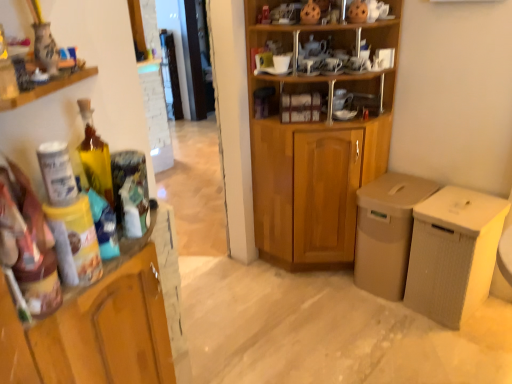
This screenshot has height=384, width=512. Identify the location of wooden cabinet at center. (298, 107).

This screenshot has width=512, height=384. Describe the element at coordinates (95, 155) in the screenshot. I see `translucent glass bottle at left` at that location.

Identify the location of wooden cabinet at center. (298, 107).

From the image's perspective, is matte ceramic vase at upper left located above translucent glass bottle at left?

Yes, from the image's perspective, matte ceramic vase at upper left is over translucent glass bottle at left.

Which of these two, matte ceramic vase at upper left or translucent glass bottle at left, is wider?

Wider between the two is matte ceramic vase at upper left.

Is matte ceramic vase at upper left beside translucent glass bottle at left?

No, matte ceramic vase at upper left is not touching translucent glass bottle at left.

Which is in front, point (18, 23) or point (82, 118)?

Point (18, 23)

From the picture: Which is nearer, (18, 103) or (324, 250)?

Point (18, 103).

At what (x,y) coordinates should I click in order to perform the action: click on cabinetry lying on the left of wooden cupboard at center. Please return your answer as a coordinate pair (x, y). The height and width of the screenshot is (384, 512). Looking at the image, I should click on click(17, 17).

Are matte ceramic vase at upper left and wooden cupboard at center located far from each other?

Absolutely, matte ceramic vase at upper left is distant from wooden cupboard at center.

Considering the relative positions of matte ceramic vase at upper left and wooden cupboard at center in the image provided, is matte ceramic vase at upper left in front of wooden cupboard at center?

That is True.

From a real-world perspective, is translucent glass bottle at left physically below matte ceramic vase at upper left?

Yes.

Which is nearer, [93,167] or [24,94]?

Point [93,167].

Is translucent glass bottle at left closer to camera compared to matte ceramic vase at upper left?

No, translucent glass bottle at left is further to the viewer.

From the image's perspective, between translucent glass bottle at left and matte ceramic vase at upper left, who is located below?

translucent glass bottle at left.

Does translucent glass bottle at left have a lesser width compared to wooden cupboard at center?

Yes, translucent glass bottle at left is thinner than wooden cupboard at center.

In the scene shown: Which of these two, translucent glass bottle at left or wooden cupboard at center, stands shorter?

With less height is translucent glass bottle at left.

In the image, is translucent glass bottle at left on the left side or the right side of wooden cupboard at center?

From the image, it's evident that translucent glass bottle at left is to the left of wooden cupboard at center.

Considering the points (311, 105) and (251, 35), which point is behind, point (311, 105) or point (251, 35)?

The point (311, 105) is behind.

Does wooden cabinet at center have a greater height compared to wooden cupboard at center?

No.

Is wooden cabinet at center surrounding wooden cupboard at center?

Definitely not — wooden cupboard at center is not inside wooden cabinet at center.

Find the location of a particular element. cabinet located on the left of wooden cupboard at center is located at coordinates (298, 107).

Is wooden cupboard at center surrounding wooden cabinet at center?

Yes, wooden cabinet at center is a part of wooden cupboard at center.

Can you tell me how much wooden cupboard at center and wooden cabinet at center differ in facing direction?

The angular difference between wooden cupboard at center and wooden cabinet at center is 45.1 degrees.

From a real-world perspective, which is physically above, wooden cupboard at center or wooden cabinet at center?

In real-world perspective, wooden cabinet at center is above.

Between point (12, 108) and point (318, 114), which one is positioned in front?

The point (12, 108) is more forward.

Which of these two, matte ceramic vase at upper left or wooden cabinet at center, is smaller?

matte ceramic vase at upper left.

Would you say matte ceramic vase at upper left is to the left or to the right of wooden cabinet at center in the picture?

Based on their positions, matte ceramic vase at upper left is located to the left of wooden cabinet at center.

This screenshot has height=384, width=512. I want to click on bottle on the right of matte ceramic vase at upper left, so click(95, 155).

Locate an element on the screen. cabinetry above the wooden cupboard at center (from a real-world perspective) is located at coordinates (17, 17).

When comparing their distances from translucent glass bottle at left, does wooden cabinet at center or wooden cupboard at center seem closer?

wooden cabinet at center lies closer to translucent glass bottle at left than the other object.

From the image, which object appears to be farther from translucent glass bottle at left, wooden cupboard at center or matte ceramic vase at upper left?

Based on the image, wooden cupboard at center appears to be further to translucent glass bottle at left.

Based on their spatial positions, is wooden cupboard at center or translucent glass bottle at left further from matte ceramic vase at upper left?

wooden cupboard at center is positioned further to the anchor matte ceramic vase at upper left.

Estimate the real-world distances between objects in this image. Which object is further from wooden cupboard at center, wooden cabinet at center or matte ceramic vase at upper left?

matte ceramic vase at upper left.

Estimate the real-world distances between objects in this image. Which object is closer to wooden cabinet at center, wooden cupboard at center or matte ceramic vase at upper left?

wooden cupboard at center lies closer to wooden cabinet at center than the other object.

Based on their spatial positions, is wooden cupboard at center or wooden cabinet at center closer to matte ceramic vase at upper left?

wooden cabinet at center lies closer to matte ceramic vase at upper left than the other object.

From the image, which object appears to be nearer to wooden cupboard at center, matte ceramic vase at upper left or wooden cabinet at center?

The object closer to wooden cupboard at center is wooden cabinet at center.

From the image, which object appears to be nearer to wooden cupboard at center, wooden cabinet at center or translucent glass bottle at left?

Based on the image, wooden cabinet at center appears to be nearer to wooden cupboard at center.

You are a GUI agent. You are given a task and a screenshot of the screen. Output one action in this format:
    pyautogui.click(x=<x>, y=<y>)
    Task: Click on the cupboard between translucent glass bottle at left and wooden cabinet at center along the z-axis
    Image resolution: width=512 pixels, height=384 pixels.
    Given the screenshot: What is the action you would take?
    pyautogui.click(x=314, y=170)

Locate an element on the screen. The image size is (512, 384). bottle between matte ceramic vase at upper left and wooden cabinet at center along the z-axis is located at coordinates (95, 155).

I want to click on bottle between matte ceramic vase at upper left and wooden cupboard at center from left to right, so click(x=95, y=155).

Identify the location of cupboard between matte ceramic vase at upper left and wooden cabinet at center from front to back. (314, 170).